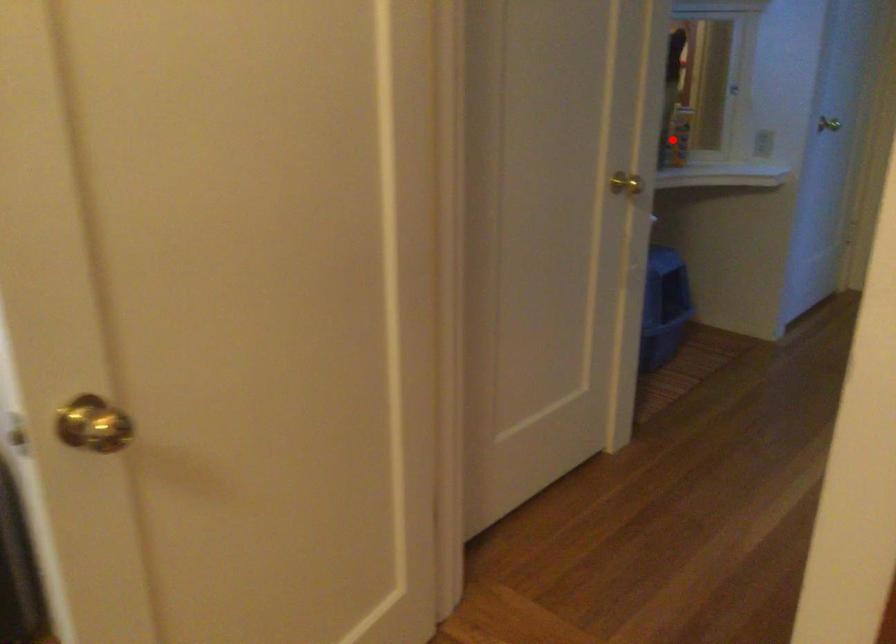
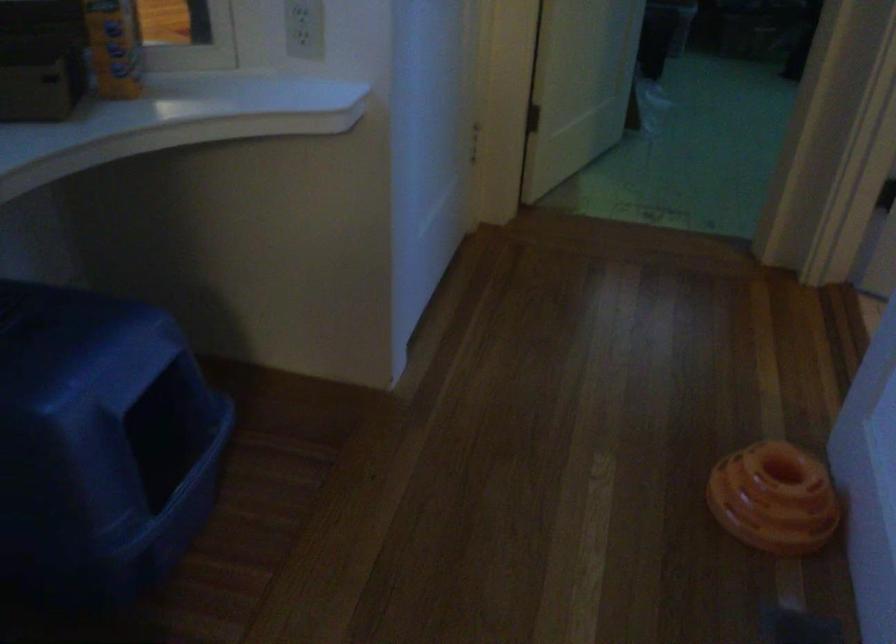
Question: I am providing you with two images of the same scene from different viewpoints. Given a red point in image1, look at the same physical point in image2. Is it:

Choices:
 (A) Closer to the viewpoint
 (B) Farther from the viewpoint

Answer: (A)